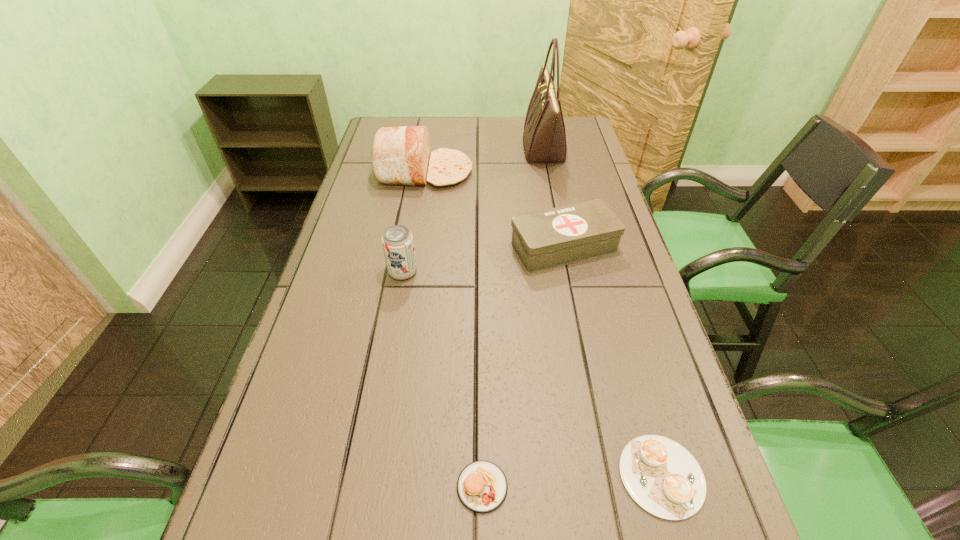
Find the location of a particular element. free space located 0.120m on the left of the beer can is located at coordinates (341, 273).

Identify the location of vacant area situated on the front of the third shortest object. (595, 400).

You are a GUI agent. You are given a task and a screenshot of the screen. Output one action in this format:
    pyautogui.click(x=<x>, y=<y>)
    Task: Click on the vacant region located 0.220m on the left of the patty
    
    Given the screenshot: What is the action you would take?
    pyautogui.click(x=325, y=487)

Identify the location of free region located 0.330m on the left of the shortest object. Image resolution: width=960 pixels, height=540 pixels. (426, 476).

This screenshot has height=540, width=960. I want to click on object located in the far edge section of the desktop, so click(x=544, y=138).

Image resolution: width=960 pixels, height=540 pixels. In order to click on object that is at the left edge in this screenshot , I will do `click(400, 155)`.

Find the location of `handbag that is positioned at the right edge`. handbag that is positioned at the right edge is located at coordinates (544, 138).

Identify the location of the first-aid kit that is positioned at the right edge. click(x=544, y=239).

Find the location of a particular element. cappuccino present at the right edge is located at coordinates (662, 477).

Where is `object located at the far right corner`? Image resolution: width=960 pixels, height=540 pixels. object located at the far right corner is located at coordinates (544, 138).